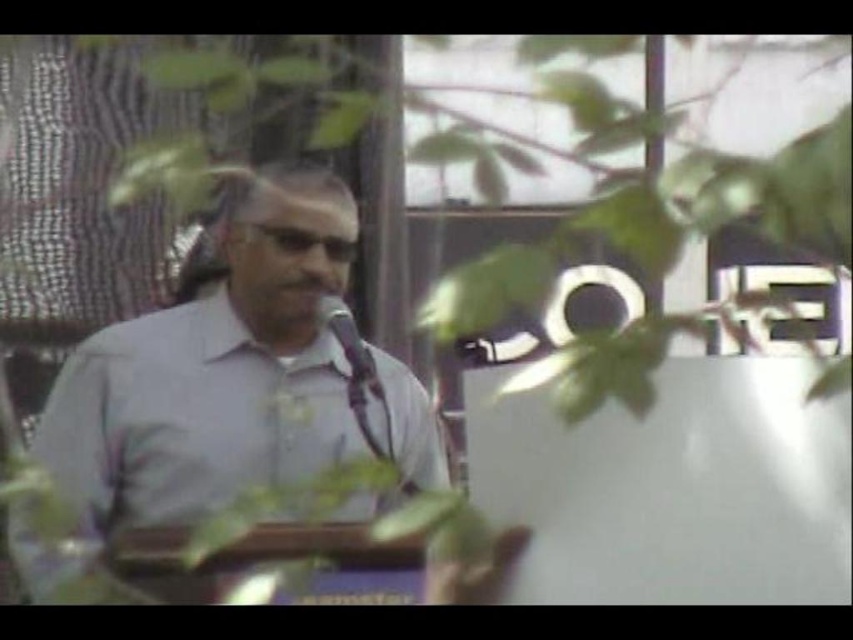
Question: Among these objects, which one is farthest from the camera?

Choices:
 (A) gray matte shirt at center
 (B) metallic silver microphone at center

Answer: (B)

Question: Which of the following is the farthest from the observer?

Choices:
 (A) metallic silver microphone at center
 (B) gray matte shirt at center

Answer: (A)

Question: Is gray matte shirt at center to the right of metallic silver microphone at center from the viewer's perspective?

Choices:
 (A) no
 (B) yes

Answer: (A)

Question: Is gray matte shirt at center thinner than metallic silver microphone at center?

Choices:
 (A) no
 (B) yes

Answer: (A)

Question: Is gray matte shirt at center positioned at the back of metallic silver microphone at center?

Choices:
 (A) no
 (B) yes

Answer: (A)